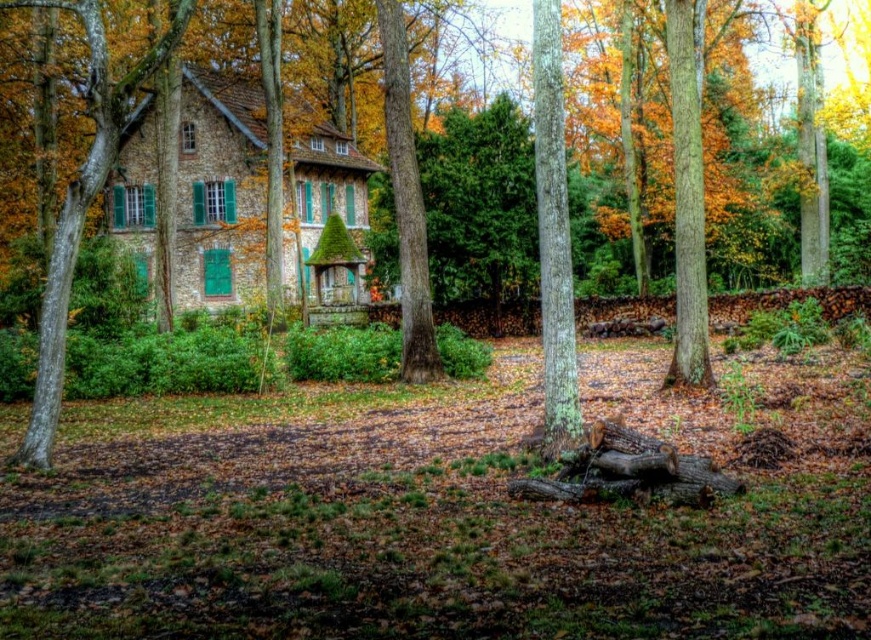
Which of these two, smooth bark tree at left or smooth brown tree trunk at right, stands shorter?

smooth brown tree trunk at right is shorter.

Is smooth bark tree at left taller than smooth brown tree trunk at right?

Correct, smooth bark tree at left is much taller as smooth brown tree trunk at right.

What do you see at coordinates (82, 205) in the screenshot? I see `smooth bark tree at left` at bounding box center [82, 205].

At what (x,y) coordinates should I click in order to perform the action: click on smooth bark tree at left. Please return your answer as a coordinate pair (x, y). Looking at the image, I should click on (82, 205).

Is green mossy bark tree at center further to camera compared to green rough bark tree at center?

No, green mossy bark tree at center is closer to the viewer.

Measure the distance between green mossy bark tree at center and camera.

green mossy bark tree at center and camera are 44.61 feet apart from each other.

The image size is (871, 640). Identify the location of green mossy bark tree at center. (552, 234).

At what (x,y) coordinates should I click in order to perform the action: click on green mossy bark tree at center. Please return your answer as a coordinate pair (x, y). The height and width of the screenshot is (640, 871). Looking at the image, I should click on (552, 234).

You are a GUI agent. You are given a task and a screenshot of the screen. Output one action in this format:
    pyautogui.click(x=<x>, y=<y>)
    Task: Click on the smooth bark tree at left
    The height and width of the screenshot is (640, 871).
    Given the screenshot: What is the action you would take?
    pyautogui.click(x=82, y=205)

Between point (100, 112) and point (414, 342), which one is positioned in front?

Point (100, 112) is more forward.

Image resolution: width=871 pixels, height=640 pixels. In order to click on smooth bark tree at left in this screenshot , I will do `click(82, 205)`.